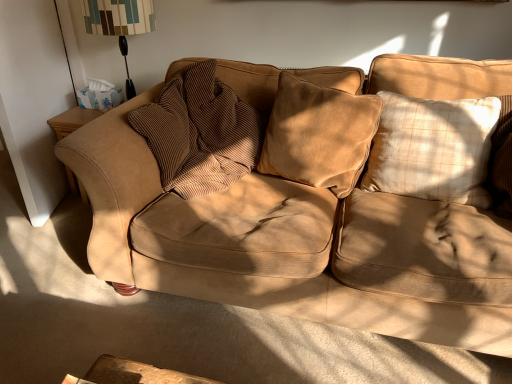
Describe the element at coordinates (206, 133) in the screenshot. I see `brown corduroy pillow at center, positioned as the third pillow in right-to-left order` at that location.

This screenshot has width=512, height=384. What do you see at coordinates (319, 135) in the screenshot?
I see `velvet brown pillow at center, arranged as the 2th pillow when viewed from the left` at bounding box center [319, 135].

The height and width of the screenshot is (384, 512). I want to click on patterned fabric lampshade at upper left, so click(119, 24).

You are a GUI agent. You are given a task and a screenshot of the screen. Output one action in this format:
    pyautogui.click(x=<x>, y=<y>)
    Task: Click on the brown corduroy pillow at center, the 1th pillow viewed from the left
    Image resolution: width=512 pixels, height=384 pixels.
    Given the screenshot: What is the action you would take?
    pyautogui.click(x=206, y=133)

Based on the photo, from the image's perspective, is brown corduroy pillow at center, the 1th pillow viewed from the left, beneath patterned fabric lampshade at upper left?

Indeed, from the image's perspective, brown corduroy pillow at center, the 1th pillow viewed from the left, is shown beneath patterned fabric lampshade at upper left.

Which is correct: brown corduroy pillow at center, the 1th pillow viewed from the left, is inside patterned fabric lampshade at upper left, or outside of it?

brown corduroy pillow at center, the 1th pillow viewed from the left, is not inside patterned fabric lampshade at upper left, it's outside.

What's the angular difference between brown corduroy pillow at center, positioned as the third pillow in right-to-left order, and patterned fabric lampshade at upper left's facing directions?

The angular difference between brown corduroy pillow at center, positioned as the third pillow in right-to-left order, and patterned fabric lampshade at upper left is 92.2 degrees.

From a real-world perspective, is brown corduroy pillow at center, the 1th pillow viewed from the left, physically located above or below patterned fabric lampshade at upper left?

In terms of real-world spatial position, brown corduroy pillow at center, the 1th pillow viewed from the left, is below patterned fabric lampshade at upper left.

Visually, is suede couch at center positioned to the left or to the right of beige plaid pillow at right, placed as the third pillow when sorted from left to right?

suede couch at center is positioned on beige plaid pillow at right, placed as the third pillow when sorted from left to right,'s left side.

Which object is further away from the camera, suede couch at center or beige plaid pillow at right, placed as the 1th pillow when sorted from right to left?

Positioned behind is beige plaid pillow at right, placed as the 1th pillow when sorted from right to left.

The image size is (512, 384). In order to click on the 3rd pillow to the right of the suede couch at center, counting from the anchor's position in this screenshot , I will do `click(433, 148)`.

From the image's perspective, is suede couch at center on beige plaid pillow at right, placed as the third pillow when sorted from left to right?

Actually, suede couch at center appears below beige plaid pillow at right, placed as the third pillow when sorted from left to right, in the image.

Consider the image. How distant is velvet brown pillow at center, which is the 2th pillow in right-to-left order, from suede couch at center?

The distance of velvet brown pillow at center, which is the 2th pillow in right-to-left order, from suede couch at center is 8.57 inches.

From a real-world perspective, which object stands above the other?

From a 3D spatial view, velvet brown pillow at center, arranged as the 2th pillow when viewed from the left, is above.

Is velvet brown pillow at center, arranged as the 2th pillow when viewed from the left, next to suede couch at center?

No.

Locate an element on the screen. The image size is (512, 384). studio couch on the left of the velvet brown pillow at center, which is the 2th pillow in right-to-left order is located at coordinates (298, 238).

Between velvet brown pillow at center, which is the 2th pillow in right-to-left order, and beige plaid pillow at right, placed as the third pillow when sorted from left to right, which one appears on the left side from the viewer's perspective?

Positioned to the left is velvet brown pillow at center, which is the 2th pillow in right-to-left order.

Which is behind, point (269, 140) or point (433, 106)?

The point (269, 140) is behind.

Which of these two, velvet brown pillow at center, arranged as the 2th pillow when viewed from the left, or beige plaid pillow at right, placed as the 1th pillow when sorted from right to left, is thinner?

velvet brown pillow at center, arranged as the 2th pillow when viewed from the left.

From a real-world perspective, is velvet brown pillow at center, which is the 2th pillow in right-to-left order, on beige plaid pillow at right, placed as the third pillow when sorted from left to right?

Yes, from a real-world perspective, velvet brown pillow at center, which is the 2th pillow in right-to-left order, is over beige plaid pillow at right, placed as the third pillow when sorted from left to right

I want to click on table lamp located on the left of beige plaid pillow at right, placed as the third pillow when sorted from left to right, so click(x=119, y=24).

Is beige plaid pillow at right, placed as the 1th pillow when sorted from right to left, beside patterned fabric lampshade at upper left?

No, beige plaid pillow at right, placed as the 1th pillow when sorted from right to left, is not in contact with patterned fabric lampshade at upper left.

From the image's perspective, does beige plaid pillow at right, placed as the 1th pillow when sorted from right to left, appear lower than patterned fabric lampshade at upper left?

Yes, from the image's perspective, beige plaid pillow at right, placed as the 1th pillow when sorted from right to left, is below patterned fabric lampshade at upper left.

Can you confirm if beige plaid pillow at right, placed as the third pillow when sorted from left to right, is taller than patterned fabric lampshade at upper left?

No, beige plaid pillow at right, placed as the third pillow when sorted from left to right, is not taller than patterned fabric lampshade at upper left.

Visually, is velvet brown pillow at center, arranged as the 2th pillow when viewed from the left, positioned to the left or to the right of brown corduroy pillow at center, the 1th pillow viewed from the left?

Clearly, velvet brown pillow at center, arranged as the 2th pillow when viewed from the left, is on the right of brown corduroy pillow at center, the 1th pillow viewed from the left, in the image.

Is the surface of velvet brown pillow at center, arranged as the 2th pillow when viewed from the left, in direct contact with brown corduroy pillow at center, the 1th pillow viewed from the left?

velvet brown pillow at center, arranged as the 2th pillow when viewed from the left, and brown corduroy pillow at center, the 1th pillow viewed from the left, are not in contact.

Between velvet brown pillow at center, arranged as the 2th pillow when viewed from the left, and brown corduroy pillow at center, positioned as the third pillow in right-to-left order, which one has more height?

brown corduroy pillow at center, positioned as the third pillow in right-to-left order, is taller.

Is velvet brown pillow at center, arranged as the 2th pillow when viewed from the left, behind brown corduroy pillow at center, the 1th pillow viewed from the left?

No.

Is velvet brown pillow at center, arranged as the 2th pillow when viewed from the left, oriented towards patterned fabric lampshade at upper left?

No, velvet brown pillow at center, arranged as the 2th pillow when viewed from the left, does not turn towards patterned fabric lampshade at upper left.

Is point (286, 143) behind point (142, 7)?

No, it is not.

Considering the relative sizes of velvet brown pillow at center, which is the 2th pillow in right-to-left order, and patterned fabric lampshade at upper left in the image provided, is velvet brown pillow at center, which is the 2th pillow in right-to-left order, shorter than patterned fabric lampshade at upper left?

Indeed, velvet brown pillow at center, which is the 2th pillow in right-to-left order, has a lesser height compared to patterned fabric lampshade at upper left.

Is patterned fabric lampshade at upper left a part of velvet brown pillow at center, which is the 2th pillow in right-to-left order?

Actually, patterned fabric lampshade at upper left is outside velvet brown pillow at center, which is the 2th pillow in right-to-left order.

Starting from the patterned fabric lampshade at upper left, which pillow is the 1st one in front? Please provide its 2D coordinates.

[(206, 133)]

Where is `studio couch that appears below the beige plaid pillow at right, placed as the 1th pillow when sorted from right to left (from a real-world perspective)`? studio couch that appears below the beige plaid pillow at right, placed as the 1th pillow when sorted from right to left (from a real-world perspective) is located at coordinates (298, 238).

Looking at the image, which one is located closer to brown corduroy pillow at center, the 1th pillow viewed from the left, velvet brown pillow at center, arranged as the 2th pillow when viewed from the left, or suede couch at center?

velvet brown pillow at center, arranged as the 2th pillow when viewed from the left.

Which object lies further to the anchor point beige plaid pillow at right, placed as the third pillow when sorted from left to right, brown corduroy pillow at center, the 1th pillow viewed from the left, or velvet brown pillow at center, arranged as the 2th pillow when viewed from the left?

brown corduroy pillow at center, the 1th pillow viewed from the left, is further to beige plaid pillow at right, placed as the third pillow when sorted from left to right.

Based on their spatial positions, is patterned fabric lampshade at upper left or beige plaid pillow at right, placed as the third pillow when sorted from left to right, closer to brown corduroy pillow at center, positioned as the third pillow in right-to-left order?

beige plaid pillow at right, placed as the third pillow when sorted from left to right, is closer to brown corduroy pillow at center, positioned as the third pillow in right-to-left order.

Estimate the real-world distances between objects in this image. Which object is closer to velvet brown pillow at center, which is the 2th pillow in right-to-left order, beige plaid pillow at right, placed as the 1th pillow when sorted from right to left, or brown corduroy pillow at center, the 1th pillow viewed from the left?

beige plaid pillow at right, placed as the 1th pillow when sorted from right to left, lies closer to velvet brown pillow at center, which is the 2th pillow in right-to-left order, than the other object.

Looking at this image, looking at the image, which one is located closer to patterned fabric lampshade at upper left, beige plaid pillow at right, placed as the third pillow when sorted from left to right, or suede couch at center?

suede couch at center.

Considering their positions, is patterned fabric lampshade at upper left positioned closer to suede couch at center than velvet brown pillow at center, which is the 2th pillow in right-to-left order?

velvet brown pillow at center, which is the 2th pillow in right-to-left order, lies closer to suede couch at center than the other object.

From the image, which object appears to be farther from patterned fabric lampshade at upper left, velvet brown pillow at center, which is the 2th pillow in right-to-left order, or brown corduroy pillow at center, positioned as the third pillow in right-to-left order?

velvet brown pillow at center, which is the 2th pillow in right-to-left order, is positioned further to the anchor patterned fabric lampshade at upper left.

Looking at the image, which one is located further to suede couch at center, brown corduroy pillow at center, positioned as the third pillow in right-to-left order, or velvet brown pillow at center, which is the 2th pillow in right-to-left order?

Among the two, brown corduroy pillow at center, positioned as the third pillow in right-to-left order, is located further to suede couch at center.

Locate an element on the screen. pillow between brown corduroy pillow at center, the 1th pillow viewed from the left, and beige plaid pillow at right, placed as the 1th pillow when sorted from right to left, from left to right is located at coordinates (319, 135).

This screenshot has height=384, width=512. In order to click on pillow between suede couch at center and velvet brown pillow at center, which is the 2th pillow in right-to-left order, from left to right in this screenshot , I will do `click(206, 133)`.

I want to click on pillow between patterned fabric lampshade at upper left and velvet brown pillow at center, arranged as the 2th pillow when viewed from the left, in the horizontal direction, so click(206, 133).

At what (x,y) coordinates should I click in order to perform the action: click on studio couch between patterned fabric lampshade at upper left and beige plaid pillow at right, placed as the third pillow when sorted from left to right, in the horizontal direction. Please return your answer as a coordinate pair (x, y). This screenshot has height=384, width=512. Looking at the image, I should click on (298, 238).